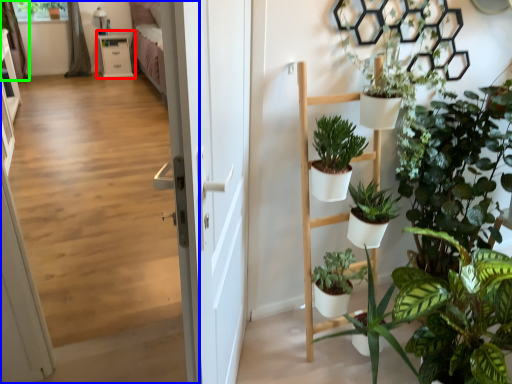
Question: Which is nearer to the table (highlighted by a red box)? corridor (highlighted by a blue box) or curtain (highlighted by a green box).

Choices:
 (A) corridor
 (B) curtain

Answer: (B)